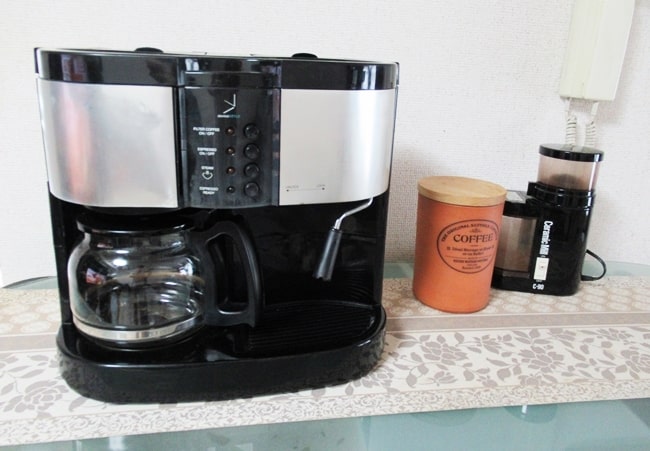
You are a GUI agent. You are given a task and a screenshot of the screen. Output one action in this format:
    pyautogui.click(x=<x>, y=<y>)
    Task: Click on the phone cord
    Image resolution: width=650 pixels, height=451 pixels.
    Given the screenshot: What is the action you would take?
    pyautogui.click(x=593, y=132), pyautogui.click(x=573, y=126)